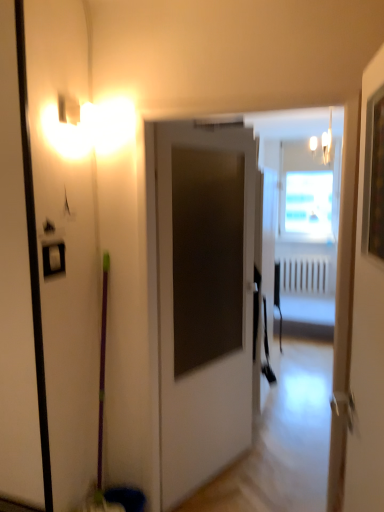
Locate an element on the screen. The image size is (384, 512). white plastic radiator at center is located at coordinates click(x=306, y=274).

The image size is (384, 512). Find the location of `radiator that appears behind the white glossy door at upper right, which is counted as the 2th door, starting from the back`. radiator that appears behind the white glossy door at upper right, which is counted as the 2th door, starting from the back is located at coordinates (306, 274).

Is white glossy door at upper right, the first door positioned from the front, positioned far away from white plastic radiator at center?

Absolutely, white glossy door at upper right, the first door positioned from the front, is distant from white plastic radiator at center.

Looking at this image, which of these two, white plastic radiator at center or white glossy door at upper right, which is counted as the 2th door, starting from the back, is smaller?

With smaller size is white plastic radiator at center.

Does point (300, 290) appear closer or farther from the camera than point (345, 345)?

Point (300, 290) is farther from the camera than point (345, 345).

Can you confirm if white plastic radiator at center is wider than white glossy door at upper right, the first door positioned from the front?

Yes.

Considering the sizes of objects white matte door at center, marked as the 1th door in a back-to-front arrangement, and white glossy door at upper right, which is counted as the 2th door, starting from the back, in the image provided, who is shorter, white matte door at center, marked as the 1th door in a back-to-front arrangement, or white glossy door at upper right, which is counted as the 2th door, starting from the back,?

white glossy door at upper right, which is counted as the 2th door, starting from the back, is shorter.

Considering the relative sizes of white matte door at center, the 2th door viewed from the front, and white glossy door at upper right, the first door positioned from the front, in the image provided, is white matte door at center, the 2th door viewed from the front, bigger than white glossy door at upper right, the first door positioned from the front,?

Indeed, white matte door at center, the 2th door viewed from the front, has a larger size compared to white glossy door at upper right, the first door positioned from the front.

Are white matte door at center, the 2th door viewed from the front, and white glossy door at upper right, which is counted as the 2th door, starting from the back, beside each other?

white matte door at center, the 2th door viewed from the front, and white glossy door at upper right, which is counted as the 2th door, starting from the back, are not in contact.

Is white matte door at center, marked as the 1th door in a back-to-front arrangement, positioned in front of white plastic radiator at center?

Yes, it is.

In terms of height, does white matte door at center, marked as the 1th door in a back-to-front arrangement, look taller or shorter compared to white plastic radiator at center?

In the image, white matte door at center, marked as the 1th door in a back-to-front arrangement, appears to be taller than white plastic radiator at center.

Is white matte door at center, marked as the 1th door in a back-to-front arrangement, not close to white plastic radiator at center?

Indeed, white matte door at center, marked as the 1th door in a back-to-front arrangement, is not near white plastic radiator at center.

Is white plastic radiator at center positioned with its back to white matte door at center, marked as the 1th door in a back-to-front arrangement?

That's not correct — white plastic radiator at center is not looking away from white matte door at center, marked as the 1th door in a back-to-front arrangement.

Considering the sizes of white plastic radiator at center and white matte door at center, the 2th door viewed from the front, in the image, is white plastic radiator at center wider or thinner than white matte door at center, the 2th door viewed from the front,?

white plastic radiator at center is thinner than white matte door at center, the 2th door viewed from the front.

Would you say white plastic radiator at center contains white matte door at center, the 2th door viewed from the front?

No, white matte door at center, the 2th door viewed from the front, is located outside of white plastic radiator at center.

From a real-world perspective, does white plastic radiator at center stand above white matte door at center, the 2th door viewed from the front?

No, from a real-world perspective, white plastic radiator at center is not over white matte door at center, the 2th door viewed from the front

Does white glossy door at upper right, the first door positioned from the front, have a lesser width compared to white matte door at center, the 2th door viewed from the front?

Yes.

Is point (341, 371) positioned after point (184, 371)?

No, it is in front of (184, 371).

Can you tell me how much white glossy door at upper right, which is counted as the 2th door, starting from the back, and white matte door at center, the 2th door viewed from the front, differ in facing direction?

The facing directions of white glossy door at upper right, which is counted as the 2th door, starting from the back, and white matte door at center, the 2th door viewed from the front, are 149 degrees apart.

Which object is positioned more to the left, white glossy door at upper right, which is counted as the 2th door, starting from the back, or white matte door at center, the 2th door viewed from the front?

Positioned to the left is white matte door at center, the 2th door viewed from the front.

In the image, there is a white glossy door at upper right, which is counted as the 2th door, starting from the back. At what (x,y) coordinates should I click in order to perform the action: click on radiator below it (from the image's perspective). Please return your answer as a coordinate pair (x, y). Looking at the image, I should click on (306, 274).

Starting from the white plastic radiator at center, which door is the 1st one to the left? Please provide its 2D coordinates.

[(359, 317)]

Which object lies further to the anchor point white plastic radiator at center, white glossy door at upper right, which is counted as the 2th door, starting from the back, or white matte door at center, the 2th door viewed from the front?

white glossy door at upper right, which is counted as the 2th door, starting from the back, lies further to white plastic radiator at center than the other object.

Which object lies further to the anchor point white glossy door at upper right, which is counted as the 2th door, starting from the back, white matte door at center, the 2th door viewed from the front, or white plastic radiator at center?

white plastic radiator at center lies further to white glossy door at upper right, which is counted as the 2th door, starting from the back, than the other object.

In the scene shown: Considering their positions, is white plastic radiator at center positioned further to white matte door at center, marked as the 1th door in a back-to-front arrangement, than white glossy door at upper right, the first door positioned from the front?

Based on the image, white plastic radiator at center appears to be further to white matte door at center, marked as the 1th door in a back-to-front arrangement.

Based on their spatial positions, is white matte door at center, marked as the 1th door in a back-to-front arrangement, or white glossy door at upper right, which is counted as the 2th door, starting from the back, further from white plastic radiator at center?

white glossy door at upper right, which is counted as the 2th door, starting from the back, is positioned further to the anchor white plastic radiator at center.

Based on their spatial positions, is white plastic radiator at center or white matte door at center, marked as the 1th door in a back-to-front arrangement, further from white glossy door at upper right, which is counted as the 2th door, starting from the back?

white plastic radiator at center is further to white glossy door at upper right, which is counted as the 2th door, starting from the back.

Looking at the image, which one is located closer to white matte door at center, the 2th door viewed from the front, white glossy door at upper right, which is counted as the 2th door, starting from the back, or white plastic radiator at center?

white glossy door at upper right, which is counted as the 2th door, starting from the back, is closer to white matte door at center, the 2th door viewed from the front.

This screenshot has width=384, height=512. Identify the location of door located between white glossy door at upper right, the first door positioned from the front, and white plastic radiator at center in the depth direction. (203, 300).